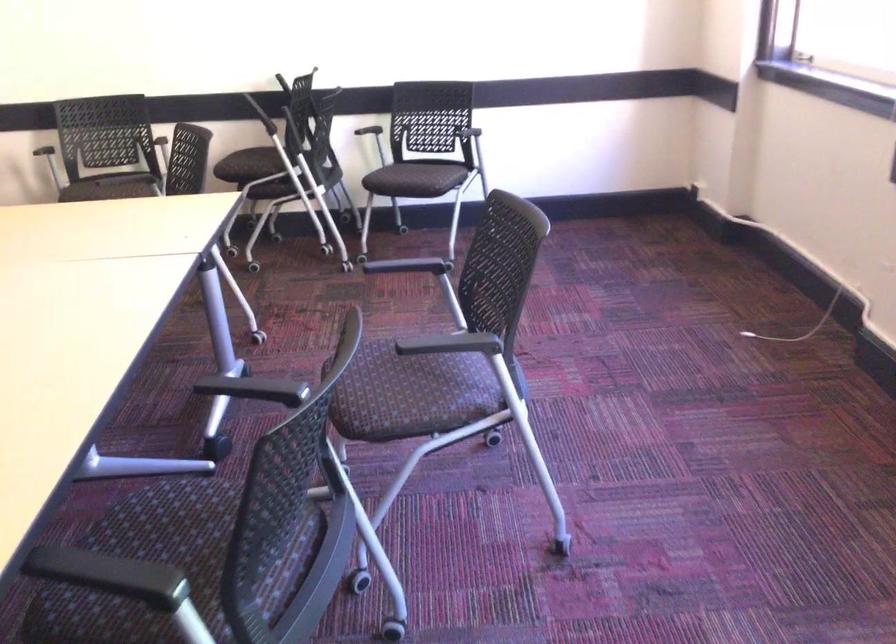
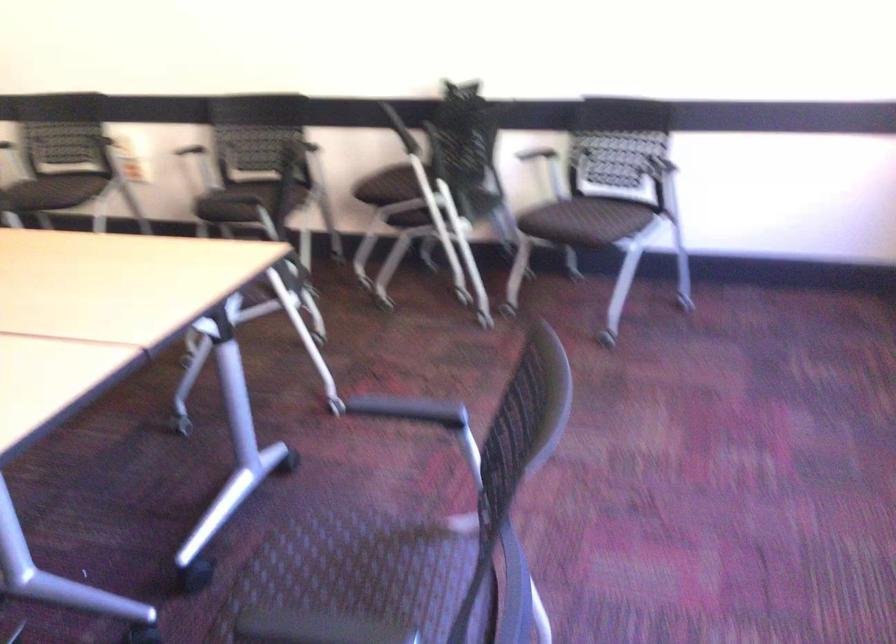
Question: The images are taken continuously from a first-person perspective. In which direction is your viewpoint rotating?

Choices:
 (A) Left
 (B) Right
 (C) Up
 (D) Down

Answer: (A)